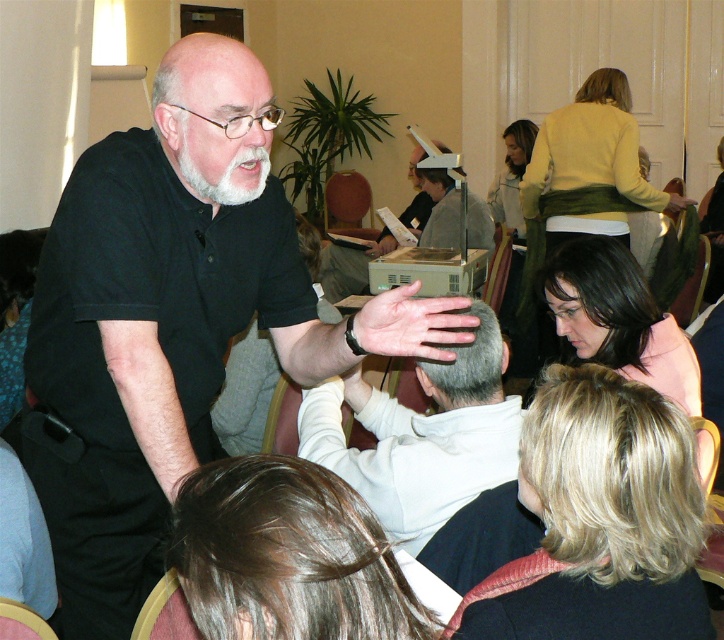
You are organizing a photo shoot and need to arrange the black matte shirt at center and the dark pink fabric at lower right in a way that follows the spatial relationship described. Where should you place the black matte shirt relative to the dark pink fabric?

The black matte shirt at center should be placed below the dark pink fabric at lower right as per the description.

You are an event planner organizing a photo shoot in this conference room. You need to position a large camera stand that requires 1.2 meters of vertical clearance. Given the objects listed, can the camera stand be placed between the black matte shirt at center and the dark pink fabric at lower right without obstruction?

The black matte shirt at center has a greater height compared to dark pink fabric at lower right. Since the camera stand requires 1.2 meters of vertical clearance, and the taller object is the black matte shirt at center, you must ensure that its height does not exceed 1.2 meters. However, without specific measurements of the objects, it is impossible to confirm if the vertical clearance is sufficient. Please verify the actual height of the black matte shirt at center before placing the camera stand.

You are organizing a charity event and need to determine which of the two items, the white matte shirt at center or the dark pink fabric at lower right, can be used as a backdrop. Based on their sizes, which one would be more suitable for covering a standard 6ft by 8ft stage backdrop?

The white matte shirt at center has a larger size compared to the dark pink fabric at lower right, making it more suitable for covering a standard 6ft by 8ft stage backdrop.